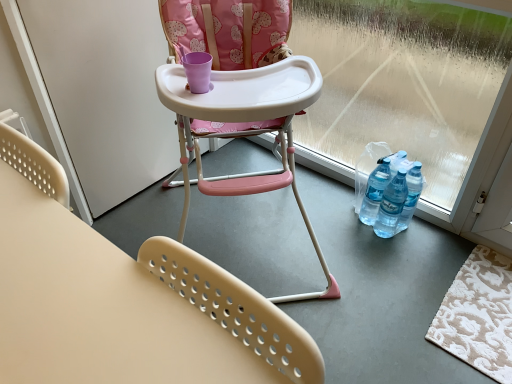
Find the location of a particular element. vacant area that is situated to the right of pink plastic highchair at center, the 2th chair when ordered from front to back is located at coordinates (395, 268).